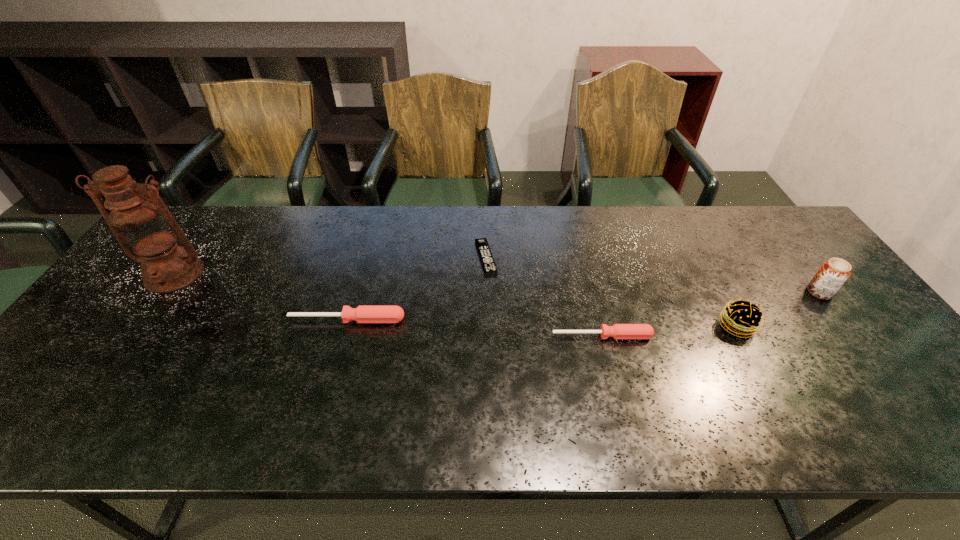
The width and height of the screenshot is (960, 540). I want to click on the farther screwdriver, so click(x=364, y=313).

Locate an element on the screen. This screenshot has width=960, height=540. the left screwdriver is located at coordinates (364, 313).

Identify the location of the fifth tallest object. Image resolution: width=960 pixels, height=540 pixels. (618, 331).

Find the location of a particular element. Image resolution: width=960 pixels, height=540 pixels. the nearer screwdriver is located at coordinates (618, 331).

Find the location of a particular element. oil lamp is located at coordinates (144, 227).

I want to click on the leftmost object, so click(144, 227).

At what (x,y) coordinates should I click in order to perform the action: click on the third tallest object. Please return your answer as a coordinate pair (x, y). The height and width of the screenshot is (540, 960). Looking at the image, I should click on (742, 318).

Find the location of a particular element. The width and height of the screenshot is (960, 540). the second object from right to left is located at coordinates (742, 318).

Where is `remote control`? This screenshot has height=540, width=960. remote control is located at coordinates (488, 263).

Image resolution: width=960 pixels, height=540 pixels. What are the coordinates of `the shortest object` in the screenshot? It's located at (488, 263).